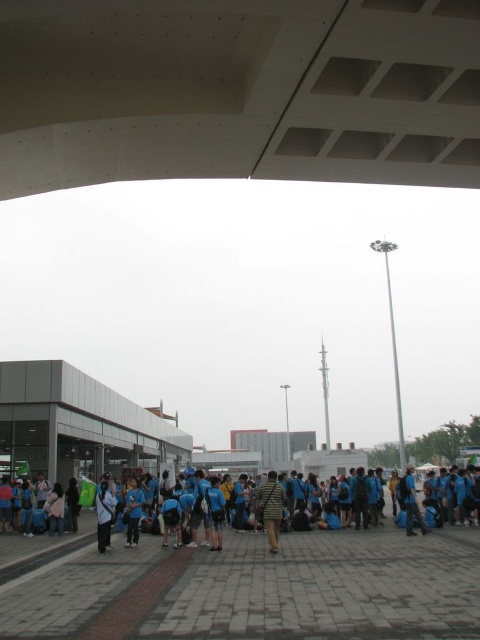
In the scene shown: Between striped fabric shirt at center and dark blue shirt at center, which one appears on the right side from the viewer's perspective?

striped fabric shirt at center is more to the right.

Between striped fabric shirt at center and dark blue shirt at center, which one is positioned higher?

striped fabric shirt at center

Who is more forward, (262,509) or (132,500)?

Positioned in front is point (262,509).

Identify the location of striped fabric shirt at center. The height and width of the screenshot is (640, 480). (271, 508).

Is point (71, 544) more distant than point (263, 516)?

Yes, it is behind point (263, 516).

Find the location of a particular element. blue fabric shirt at center is located at coordinates (41, 540).

Identify the location of blue fabric shirt at center. click(41, 540).

Is point (276, 524) more distant than point (107, 500)?

No, it is in front of (107, 500).

What do you see at coordinates (271, 508) in the screenshot? I see `striped fabric shirt at center` at bounding box center [271, 508].

Is point (276, 508) farther from camera compared to point (97, 525)?

That is False.

Find the location of a particular element. Image resolution: width=480 pixels, height=640 pixels. striped fabric shirt at center is located at coordinates (271, 508).